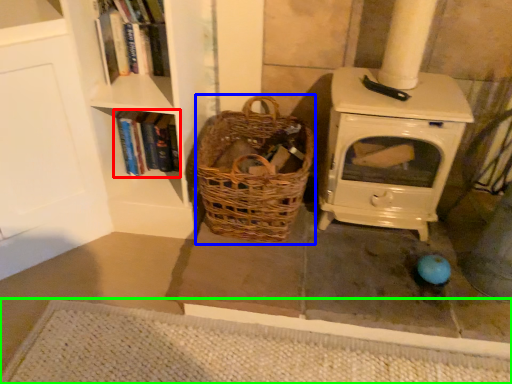
Question: Which object is positioned closest to book (highlighted by a red box)? Select from basket (highlighted by a blue box) and doormat (highlighted by a green box).

Choices:
 (A) basket
 (B) doormat

Answer: (A)